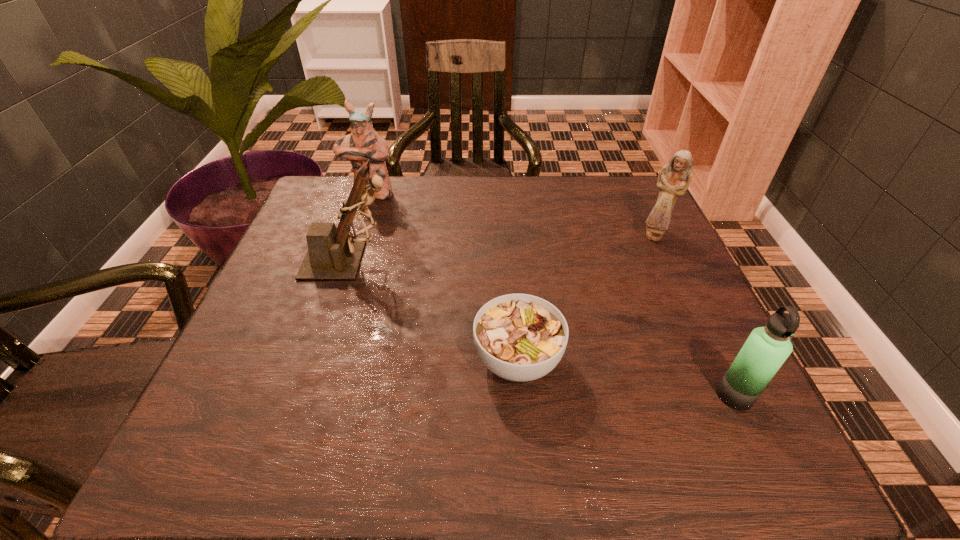
This screenshot has width=960, height=540. I want to click on thermos bottle present at the right edge, so click(766, 349).

Identify the location of object that is at the far left corner. (364, 143).

This screenshot has width=960, height=540. I want to click on object situated at the far right corner, so click(674, 178).

Where is `vacant space at the far edge of the desktop`? vacant space at the far edge of the desktop is located at coordinates (434, 222).

Locate an element on the screen. This screenshot has width=960, height=540. vacant space at the near edge of the desktop is located at coordinates (444, 431).

The width and height of the screenshot is (960, 540). What are the coordinates of `free space at the left edge of the desktop` in the screenshot? It's located at (285, 313).

In the image, there is a desktop. Identify the location of vacant space at the right edge. (642, 233).

This screenshot has width=960, height=540. In order to click on free space at the far left corner of the desktop in this screenshot , I will do `click(335, 204)`.

Locate an element on the screen. vacant space at the near left corner is located at coordinates (283, 430).

In the image, there is a desktop. Find the location of `vacant space at the far right corner`. vacant space at the far right corner is located at coordinates (636, 224).